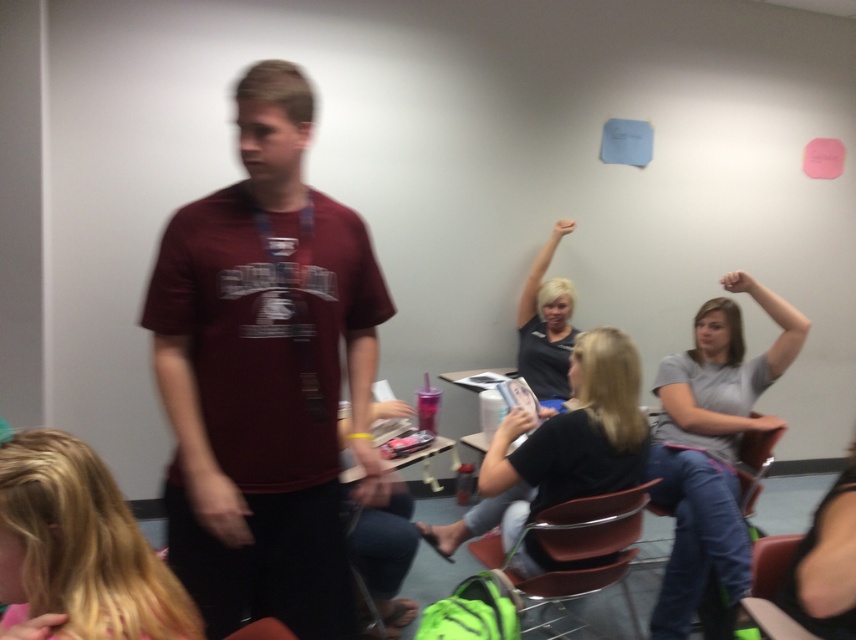
Question: Is blonde hair at lower left above matte black hand at center?

Choices:
 (A) yes
 (B) no

Answer: (B)

Question: Which object appears closest to the camera in this image?

Choices:
 (A) metallic brown chair at lower center
 (B) matte black hand at center
 (C) matte black shirt at center

Answer: (A)

Question: Which point appears closest to the camera in this image?

Choices:
 (A) (568, 230)
 (B) (498, 426)

Answer: (B)

Question: Which object is closer to the camera taking this photo?

Choices:
 (A) metallic brown chair at lower center
 (B) blonde hair at lower left
 (C) pink matte hand at upper center
 (D) matte black shirt at center

Answer: (B)

Question: Where is maroon t-shirt at center located in relation to blonde hair at lower left in the image?

Choices:
 (A) left
 (B) right

Answer: (B)

Question: Does metallic brown chair at lower center have a greater width compared to matte black shirt at center?

Choices:
 (A) yes
 (B) no

Answer: (A)